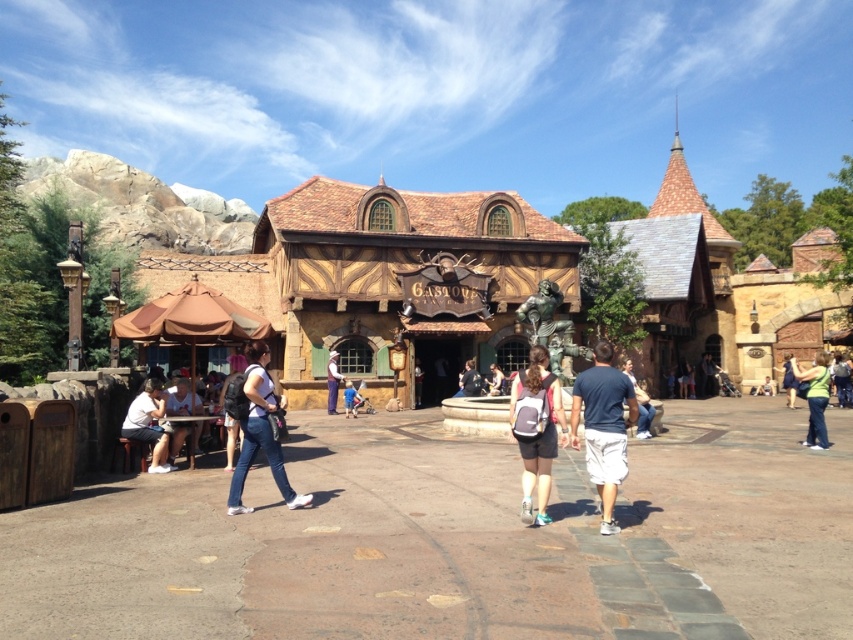
Between point (822, 356) and point (473, 362), which one is positioned behind?

The point (473, 362) is behind.

Can you confirm if green fabric backpack at lower right is positioned below matte black backpack at center?

Incorrect, green fabric backpack at lower right is not positioned below matte black backpack at center.

Locate an element on the screen. The image size is (853, 640). green fabric backpack at lower right is located at coordinates (815, 397).

Where is `green fabric backpack at lower right`? This screenshot has height=640, width=853. green fabric backpack at lower right is located at coordinates (815, 397).

Between point (820, 428) and point (329, 372), which one is positioned behind?

The point (329, 372) is more distant.

Where is `green fabric backpack at lower right`? The height and width of the screenshot is (640, 853). green fabric backpack at lower right is located at coordinates (815, 397).

Is matte black backpack at center positioned at the back of blue denim shorts at center?

That is True.

The height and width of the screenshot is (640, 853). What do you see at coordinates (469, 380) in the screenshot? I see `matte black backpack at center` at bounding box center [469, 380].

This screenshot has height=640, width=853. Identify the location of matte black backpack at center. (469, 380).